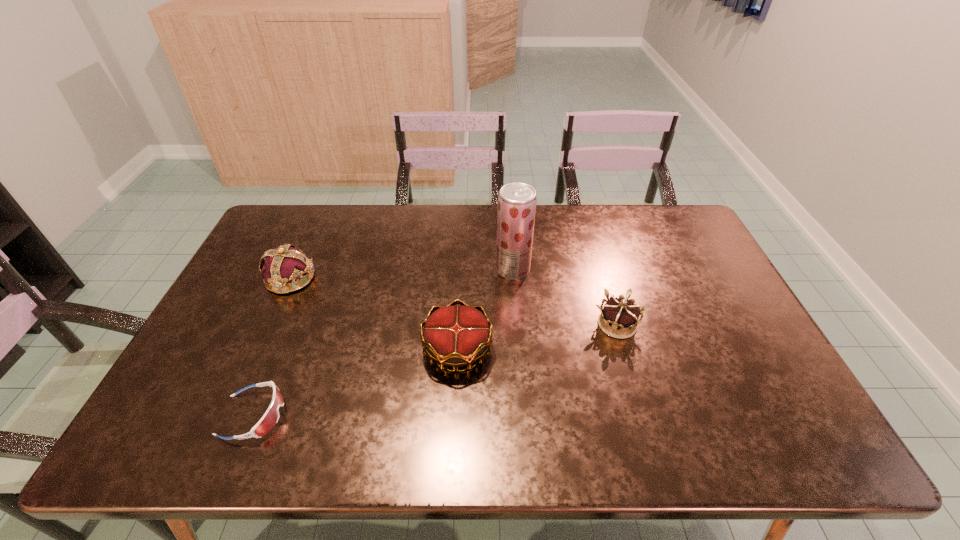
Locate an element on the screen. This screenshot has width=960, height=540. unoccupied area between the second tallest object and the tallest object is located at coordinates (401, 274).

The image size is (960, 540). Identify the location of unoccupied area between the third object from left to right and the rightmost crown. click(x=538, y=337).

Locate an element on the screen. object that stands as the third closest to the tallest crown is located at coordinates (517, 201).

The width and height of the screenshot is (960, 540). Find the location of `the second closest object to the rightmost crown`. the second closest object to the rightmost crown is located at coordinates (455, 336).

Select which crown is the second closest to the shortest object. Please provide its 2D coordinates. Your answer should be formatted as a tuple, i.e. [(x, y)], where the tuple contains the x and y coordinates of a point satisfying the conditions above.

[(285, 264)]

This screenshot has width=960, height=540. Find the location of `crown that stands as the closest to the tallest crown`. crown that stands as the closest to the tallest crown is located at coordinates (455, 336).

Where is `blank space that satisfies the following two spatial constraints: 1. on the back side of the second crown from left to right; 2. on the right side of the tallest object`? This screenshot has height=540, width=960. blank space that satisfies the following two spatial constraints: 1. on the back side of the second crown from left to right; 2. on the right side of the tallest object is located at coordinates (462, 269).

You are a GUI agent. You are given a task and a screenshot of the screen. Output one action in this format:
    pyautogui.click(x=<x>, y=<y>)
    Task: Click on the free point that satisfies the following two spatial constraints: 1. on the back side of the second crown from left to right; 2. on the right side of the rightmost object
    The height and width of the screenshot is (540, 960).
    Given the screenshot: What is the action you would take?
    pyautogui.click(x=459, y=325)

Locate an element on the screen. This screenshot has width=960, height=540. free space that satisfies the following two spatial constraints: 1. on the back side of the second crown from right to left; 2. on the left side of the rightmost crown is located at coordinates (459, 325).